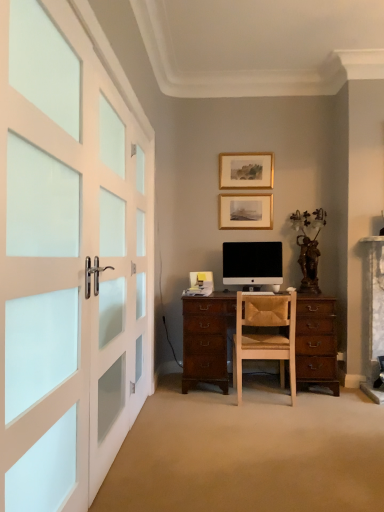
In order to face black matte computer monitor at center, should I rotate leftwards or rightwards?

You should look right and rotate roughly 8.225 degrees.

Measure the distance between black matte computer monitor at center and camera.

black matte computer monitor at center is 3.69 meters away from camera.

Find the location of a particular element. This screenshot has height=512, width=384. gold/glossy picture frame at upper center, which appears as the 1th picture frame when viewed from the top is located at coordinates (246, 170).

What is the approximate width of gold/glossy picture frame at upper center, which is the second picture frame in bottom-to-top order?

gold/glossy picture frame at upper center, which is the second picture frame in bottom-to-top order, is 2.36 inches wide.

Locate an element on the screen. white frosted glass doors at left is located at coordinates (68, 261).

The width and height of the screenshot is (384, 512). What do you see at coordinates (68, 261) in the screenshot?
I see `white frosted glass doors at left` at bounding box center [68, 261].

The height and width of the screenshot is (512, 384). Describe the element at coordinates (265, 335) in the screenshot. I see `light brown wood chair at center` at that location.

Locate an element on the screen. This screenshot has height=512, width=384. black matte computer monitor at center is located at coordinates (252, 264).

Can you tell me how much light brown wood chair at center and black matte computer monitor at center differ in facing direction?

The facing directions of light brown wood chair at center and black matte computer monitor at center are 180 degrees apart.

From the image's perspective, between light brown wood chair at center and black matte computer monitor at center, which one is located above?

black matte computer monitor at center, from the image's perspective.

Is light brown wood chair at center not inside black matte computer monitor at center?

Yes, light brown wood chair at center is not within black matte computer monitor at center.

Based on the photo, does white frosted glass doors at left have a lesser height compared to light brown wood chair at center?

No, white frosted glass doors at left is not shorter than light brown wood chair at center.

In the scene shown: Considering the sizes of objects white frosted glass doors at left and light brown wood chair at center in the image provided, who is bigger, white frosted glass doors at left or light brown wood chair at center?

With larger size is white frosted glass doors at left.

From a real-world perspective, who is located lower, white frosted glass doors at left or light brown wood chair at center?

light brown wood chair at center is physically lower.

Is wooden picture frame at center, which ranks as the second picture frame in top-to-bottom order, completely or partially outside of gold/glossy picture frame at upper center, which appears as the 1th picture frame when viewed from the top?

Yes, wooden picture frame at center, which ranks as the second picture frame in top-to-bottom order, is located beyond the bounds of gold/glossy picture frame at upper center, which appears as the 1th picture frame when viewed from the top.

Which is nearer, (249, 219) or (271, 174)?

Point (249, 219) is farther from the camera than point (271, 174).

From a real-world perspective, is wooden picture frame at center, marked as the first picture frame in a bottom-to-top arrangement, positioned over gold/glossy picture frame at upper center, which is the second picture frame in bottom-to-top order, based on gravity?

No.

Are wooden picture frame at center, marked as the first picture frame in a bottom-to-top arrangement, and gold/glossy picture frame at upper center, which appears as the 1th picture frame when viewed from the top, making contact?

No, wooden picture frame at center, marked as the first picture frame in a bottom-to-top arrangement, is not with gold/glossy picture frame at upper center, which appears as the 1th picture frame when viewed from the top.

How many degrees apart are the facing directions of light brown wood chair at center and white frosted glass doors at left?

The angle between the facing direction of light brown wood chair at center and the facing direction of white frosted glass doors at left is 92 degrees.

Is light brown wood chair at center far away from white frosted glass doors at left?

Indeed, light brown wood chair at center is not near white frosted glass doors at left.

From the image's perspective, is light brown wood chair at center located beneath white frosted glass doors at left?

Yes, from the image's perspective, light brown wood chair at center is below white frosted glass doors at left.

Consider the image. Which is more to the right, light brown wood chair at center or white frosted glass doors at left?

light brown wood chair at center.

Looking at their sizes, would you say gold/glossy picture frame at upper center, which is the second picture frame in bottom-to-top order, is wider or thinner than light brown wood chair at center?

Clearly, gold/glossy picture frame at upper center, which is the second picture frame in bottom-to-top order, has less width compared to light brown wood chair at center.

This screenshot has width=384, height=512. Identify the location of the 2nd picture frame above the light brown wood chair at center (from the image's perspective). (246, 170).

From a real-world perspective, which object stands above the other?

gold/glossy picture frame at upper center, which appears as the 1th picture frame when viewed from the top, is physically above.

Does gold/glossy picture frame at upper center, which appears as the 1th picture frame when viewed from the top, touch light brown wood chair at center?

gold/glossy picture frame at upper center, which appears as the 1th picture frame when viewed from the top, and light brown wood chair at center are clearly separated.

Can you confirm if wooden picture frame at center, marked as the first picture frame in a bottom-to-top arrangement, is positioned to the right of white frosted glass doors at left?

Yes.

Is wooden picture frame at center, which ranks as the second picture frame in top-to-bottom order, inside or outside of white frosted glass doors at left?

The correct answer is: outside.

From the image's perspective, which one is positioned lower, wooden picture frame at center, which ranks as the second picture frame in top-to-bottom order, or white frosted glass doors at left?

From the image's view, white frosted glass doors at left is below.

Locate an element on the screen. The image size is (384, 512). garage door below the wooden picture frame at center, marked as the first picture frame in a bottom-to-top arrangement (from a real-world perspective) is located at coordinates (68, 261).

From a real-world perspective, which object stands above the other?

black matte computer monitor at center is physically above.

Which is behind, point (225, 277) or point (241, 314)?

Point (225, 277)

Considering their positions, is black matte computer monitor at center located in front of or behind light brown wood chair at center?

Clearly, black matte computer monitor at center is behind light brown wood chair at center.

Which of these two, black matte computer monitor at center or light brown wood chair at center, stands taller?

light brown wood chair at center is taller.

In order to click on chair that is under the black matte computer monitor at center (from a real-world perspective) in this screenshot , I will do `click(265, 335)`.

Find the location of a particular element. garage door above the light brown wood chair at center (from the image's perspective) is located at coordinates (68, 261).

Based on their spatial positions, is wooden picture frame at center, marked as the first picture frame in a bottom-to-top arrangement, or light brown wood chair at center closer to black matte computer monitor at center?

wooden picture frame at center, marked as the first picture frame in a bottom-to-top arrangement, is positioned closer to the anchor black matte computer monitor at center.

Considering their positions, is gold/glossy picture frame at upper center, which appears as the 1th picture frame when viewed from the top, positioned closer to wooden picture frame at center, which ranks as the second picture frame in top-to-bottom order, than white frosted glass doors at left?

gold/glossy picture frame at upper center, which appears as the 1th picture frame when viewed from the top, is closer to wooden picture frame at center, which ranks as the second picture frame in top-to-bottom order.

Looking at the image, which one is located further to white frosted glass doors at left, wooden picture frame at center, marked as the first picture frame in a bottom-to-top arrangement, or light brown wood chair at center?

wooden picture frame at center, marked as the first picture frame in a bottom-to-top arrangement, lies further to white frosted glass doors at left than the other object.

Which object lies further to the anchor point gold/glossy picture frame at upper center, which is the second picture frame in bottom-to-top order, light brown wood chair at center or black matte computer monitor at center?

light brown wood chair at center lies further to gold/glossy picture frame at upper center, which is the second picture frame in bottom-to-top order, than the other object.

When comparing their distances from black matte computer monitor at center, does white frosted glass doors at left or wooden picture frame at center, which ranks as the second picture frame in top-to-bottom order, seem closer?

Based on the image, wooden picture frame at center, which ranks as the second picture frame in top-to-bottom order, appears to be nearer to black matte computer monitor at center.

Which object lies nearer to the anchor point white frosted glass doors at left, wooden picture frame at center, which ranks as the second picture frame in top-to-bottom order, or gold/glossy picture frame at upper center, which is the second picture frame in bottom-to-top order?

wooden picture frame at center, which ranks as the second picture frame in top-to-bottom order.

Which object lies nearer to the anchor point light brown wood chair at center, gold/glossy picture frame at upper center, which is the second picture frame in bottom-to-top order, or white frosted glass doors at left?

white frosted glass doors at left lies closer to light brown wood chair at center than the other object.

Which object lies further to the anchor point black matte computer monitor at center, light brown wood chair at center or gold/glossy picture frame at upper center, which is the second picture frame in bottom-to-top order?

The object further to black matte computer monitor at center is gold/glossy picture frame at upper center, which is the second picture frame in bottom-to-top order.

Where is `picture frame between gold/glossy picture frame at upper center, which is the second picture frame in bottom-to-top order, and black matte computer monitor at center, in the vertical direction`? This screenshot has height=512, width=384. picture frame between gold/glossy picture frame at upper center, which is the second picture frame in bottom-to-top order, and black matte computer monitor at center, in the vertical direction is located at coordinates [246, 211].

The height and width of the screenshot is (512, 384). I want to click on chair between white frosted glass doors at left and gold/glossy picture frame at upper center, which appears as the 1th picture frame when viewed from the top, from front to back, so click(265, 335).

What are the coordinates of `television between wooden picture frame at center, marked as the first picture frame in a bottom-to-top arrangement, and light brown wood chair at center vertically` in the screenshot? It's located at (252, 264).

Locate an element on the screen. picture frame between gold/glossy picture frame at upper center, which is the second picture frame in bottom-to-top order, and light brown wood chair at center, in the vertical direction is located at coordinates (246, 211).